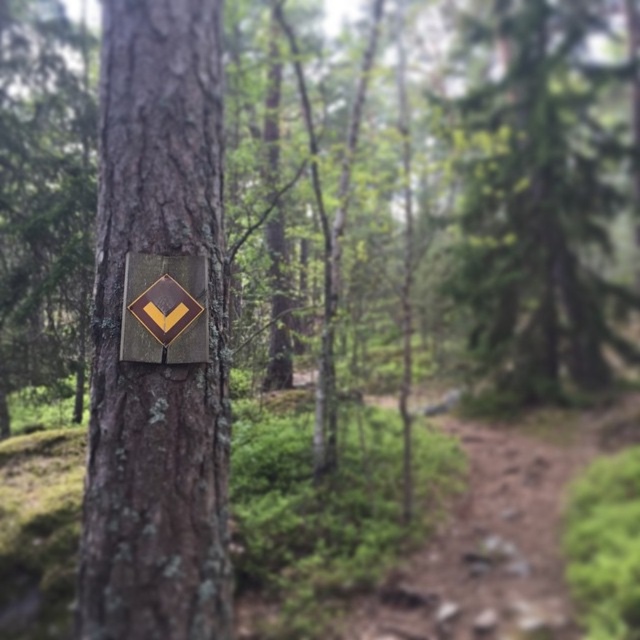
Question: Which of the following is the closest to the observer?

Choices:
 (A) (177, 326)
 (B) (161, 243)

Answer: (A)

Question: Can you confirm if smooth bark sign at center is wider than metallic gold diamond at center?

Choices:
 (A) yes
 (B) no

Answer: (A)

Question: Where is smooth bark sign at center located in relation to green textured tree at center in the image?

Choices:
 (A) above
 (B) below

Answer: (B)

Question: Can you confirm if green textured tree at center is positioned to the left of metallic gold diamond at center?

Choices:
 (A) yes
 (B) no

Answer: (B)

Question: Which point appears farthest from the camera in this image?

Choices:
 (A) (186, 564)
 (B) (467, 380)
 (C) (157, 353)

Answer: (B)

Question: Which point appears closest to the camera in this image?

Choices:
 (A) (93, 388)
 (B) (173, 314)

Answer: (B)